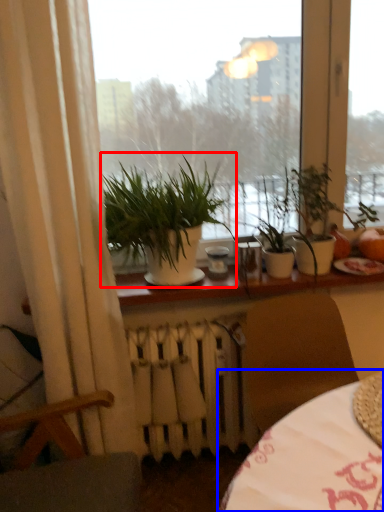
Question: Among these objects, which one is nearest to the camera, houseplant (highlighted by a red box) or table (highlighted by a blue box)?

Choices:
 (A) houseplant
 (B) table

Answer: (B)